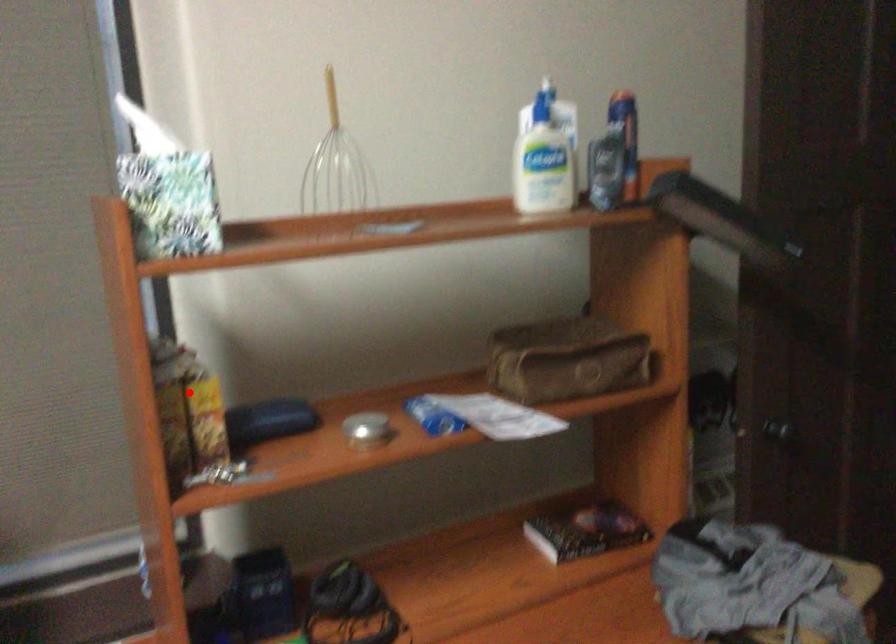
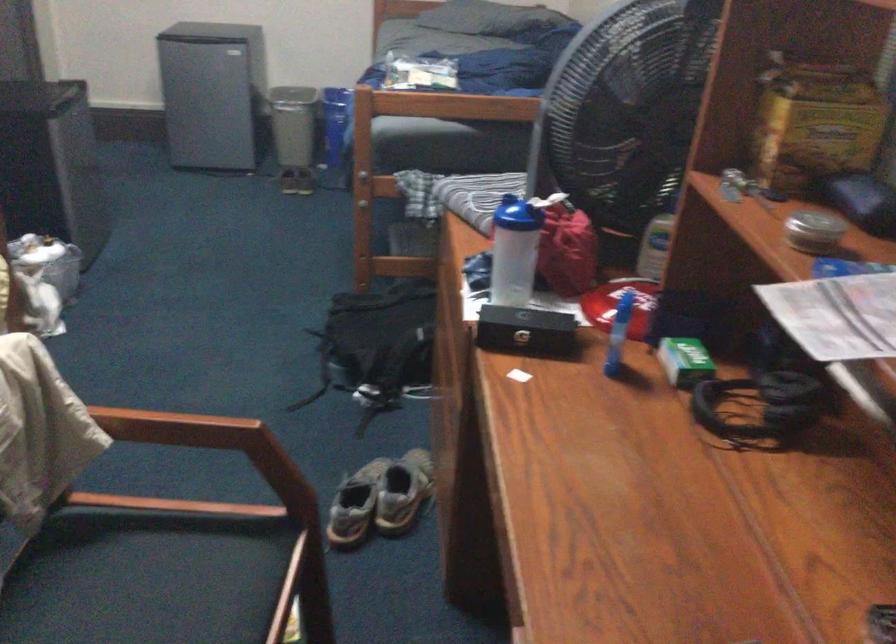
Find the pixel in the second image that matches the highlighted location in the first image.

(814, 124)